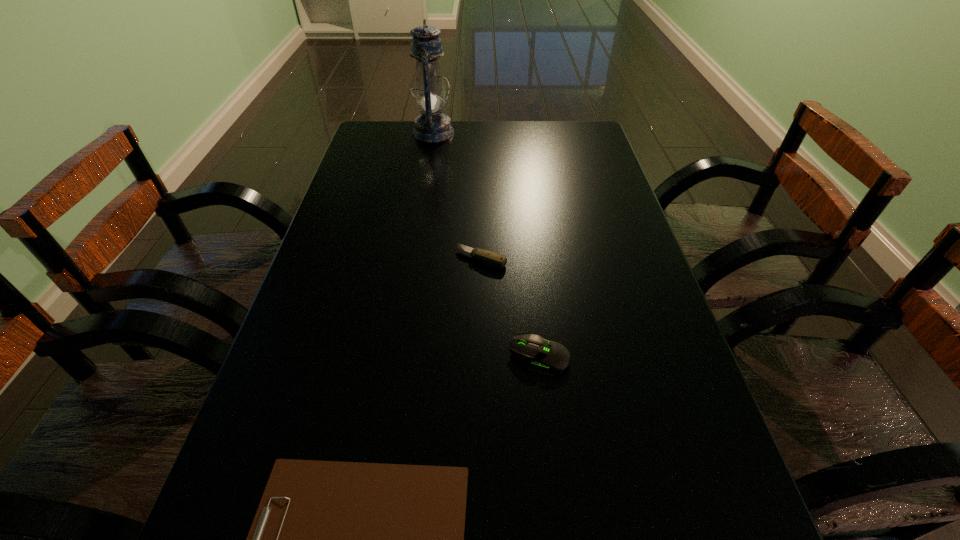
You are a GUI agent. You are given a task and a screenshot of the screen. Output one action in this format:
    pyautogui.click(x=<x>, y=<y>)
    Task: Click on the lantern
    
    Given the screenshot: What is the action you would take?
    pyautogui.click(x=432, y=126)

This screenshot has height=540, width=960. I want to click on the tallest object, so click(x=432, y=126).

Find the location of a particular element. The image size is (960, 540). the second nearest object is located at coordinates (545, 357).

Locate an element on the screen. the third nearest object is located at coordinates (491, 258).

At what (x,y) coordinates should I click in order to perform the action: click on pocketknife. Please return your answer as a coordinate pair (x, y). Image resolution: width=960 pixels, height=540 pixels. Looking at the image, I should click on (491, 258).

At what (x,y) coordinates should I click in order to perform the action: click on vacant area located 0.360m on the front-facing side of the tallest object. Please return your answer as a coordinate pair (x, y). Looking at the image, I should click on (562, 132).

Identify the location of vacant space positioned on the left of the third farthest object. (372, 357).

The height and width of the screenshot is (540, 960). I want to click on free spot located on the left of the pocketknife, so click(x=321, y=258).

Identify the location of object located at the far edge. This screenshot has width=960, height=540. (432, 126).

Where is `object that is at the left edge`? object that is at the left edge is located at coordinates (432, 126).